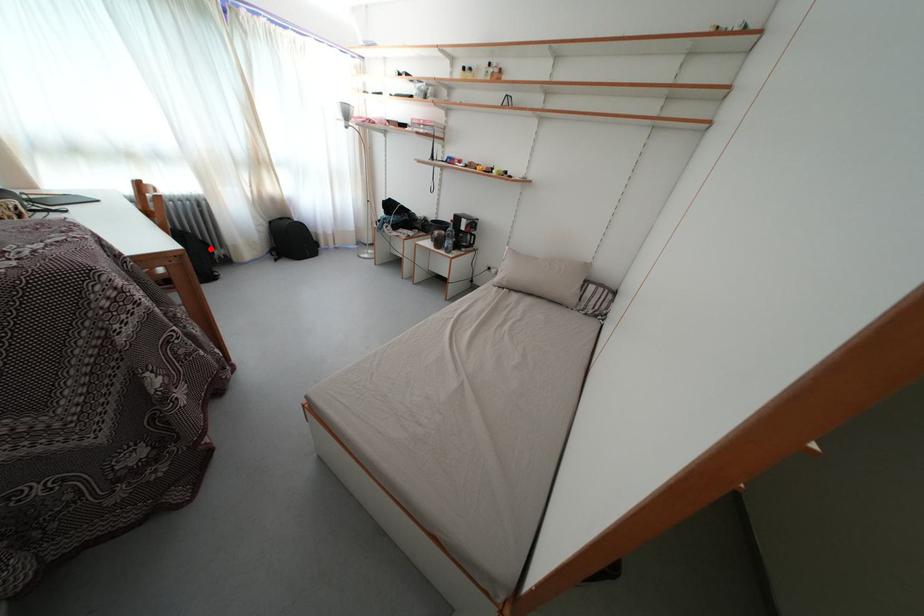
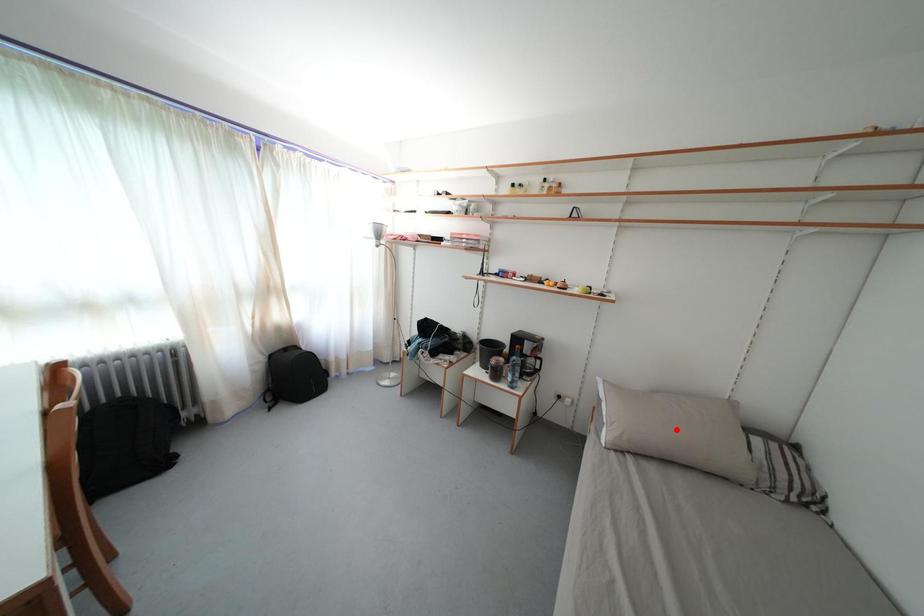
I am providing you with two images of the same scene from different viewpoints. A red point is marked on the first image and another point is marked on the second image. Is the red point in image1 aligned with the point shown in image2?

No